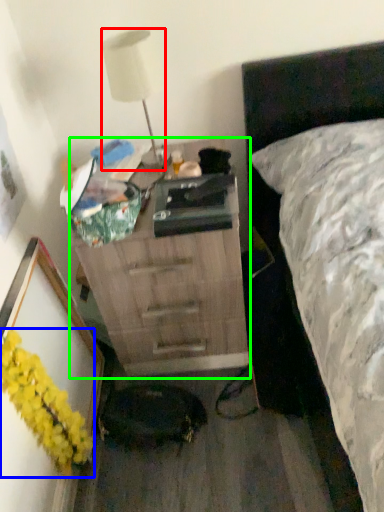
Question: Based on their relative distances, which object is farther from lamp (highlighted by a red box)? Choose from flower (highlighted by a blue box) and chest of drawers (highlighted by a green box).

Choices:
 (A) flower
 (B) chest of drawers

Answer: (A)